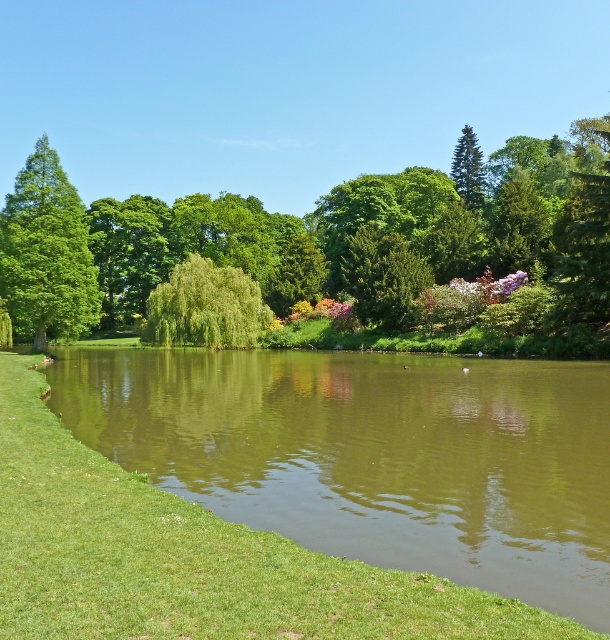
Question: Does green leafy tree at center lie behind green glossy tree at upper left?

Choices:
 (A) yes
 (B) no

Answer: (B)

Question: Does green glossy tree at upper left have a larger size compared to green leafy willow at center?

Choices:
 (A) yes
 (B) no

Answer: (A)

Question: Does green reflective water at center have a larger size compared to green glossy tree at upper left?

Choices:
 (A) yes
 (B) no

Answer: (B)

Question: Which object is positioned farthest from the green reflective water at center?

Choices:
 (A) green glossy tree at upper right
 (B) green leafy tree at center
 (C) green glossy tree at upper left

Answer: (A)

Question: Which point appears farthest from the camera in this image?

Choices:
 (A) (210, 342)
 (B) (9, 243)

Answer: (A)

Question: Which point appears closest to the camera in this image?

Choices:
 (A) (403, 248)
 (B) (462, 138)
 (C) (59, 230)
 (D) (184, 289)

Answer: (C)